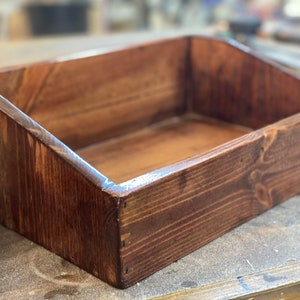
This screenshot has width=300, height=300. Find the location of `side of wooden box`. side of wooden box is located at coordinates (43, 171).